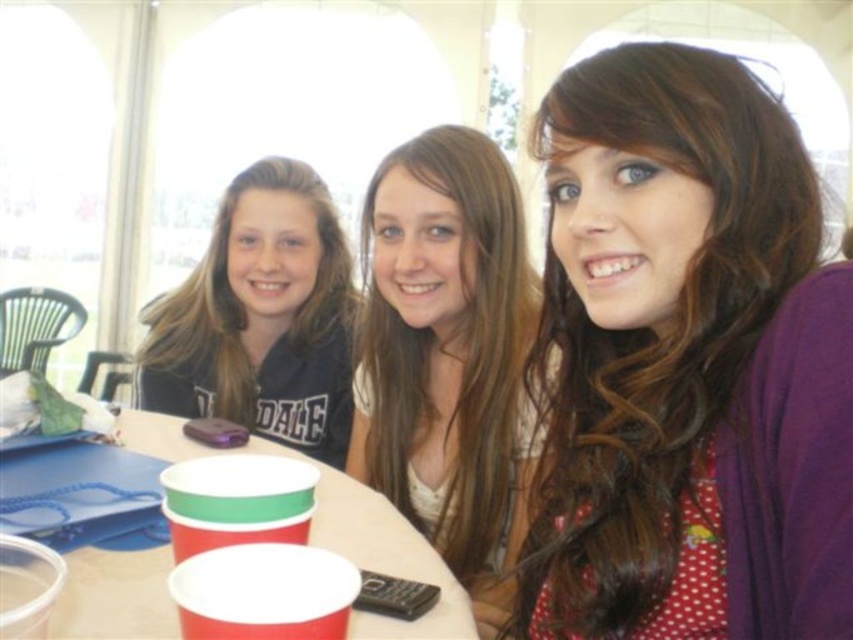
Looking at this image, is matte black hoodie at upper left closer to the viewer compared to red paper cups at center?

That is False.

Is point (152, 408) farther from viewer compared to point (96, 628)?

Yes, point (152, 408) is farther from viewer.

Locate an element on the screen. This screenshot has width=853, height=640. matte black hoodie at upper left is located at coordinates (260, 317).

Does matte black hoodie at upper left have a greater width compared to red paper cup at lower center?

Indeed, matte black hoodie at upper left has a greater width compared to red paper cup at lower center.

What do you see at coordinates (260, 317) in the screenshot? I see `matte black hoodie at upper left` at bounding box center [260, 317].

The height and width of the screenshot is (640, 853). What are the coordinates of `matte black hoodie at upper left` in the screenshot? It's located at (260, 317).

Which is more to the right, purple fabric at center or matte black hoodie at upper left?

Positioned to the right is purple fabric at center.

Is point (579, 456) closer to camera compared to point (306, 353)?

Yes, point (579, 456) is in front of point (306, 353).

Is point (643, 577) positioned before point (335, 225)?

That is True.

This screenshot has height=640, width=853. In order to click on purple fabric at center in this screenshot , I will do `click(686, 364)`.